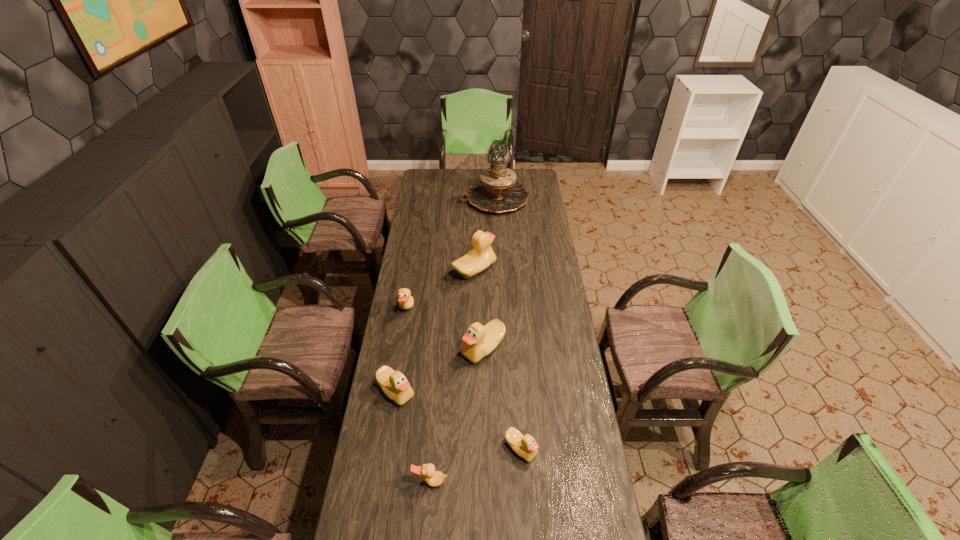
This screenshot has height=540, width=960. I want to click on the farthest object, so click(x=497, y=192).

Where is `the tallest object`? the tallest object is located at coordinates (497, 192).

Find the location of a particular element. the tallest duck is located at coordinates (481, 256).

The image size is (960, 540). Identify the location of the biggest beige duck. (481, 256).

This screenshot has width=960, height=540. Find the location of `the fifth shortest object`. the fifth shortest object is located at coordinates (479, 341).

The image size is (960, 540). Identify the location of the third farthest duck. (479, 341).

The width and height of the screenshot is (960, 540). In order to click on the third nearest duck in this screenshot , I will do `click(394, 384)`.

Locate an element on the screen. the leftmost beige duck is located at coordinates pyautogui.click(x=394, y=384).

The height and width of the screenshot is (540, 960). Find the location of `the left tan duck`. the left tan duck is located at coordinates (405, 300).

Identify the location of the third farthest object. (405, 300).